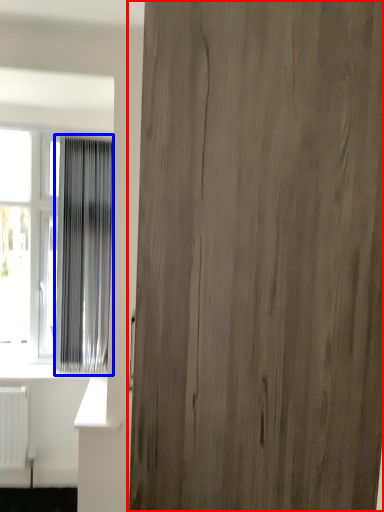
Question: Which object is closer to the camera taking this photo, door (highlighted by a red box) or curtain (highlighted by a blue box)?

Choices:
 (A) door
 (B) curtain

Answer: (A)